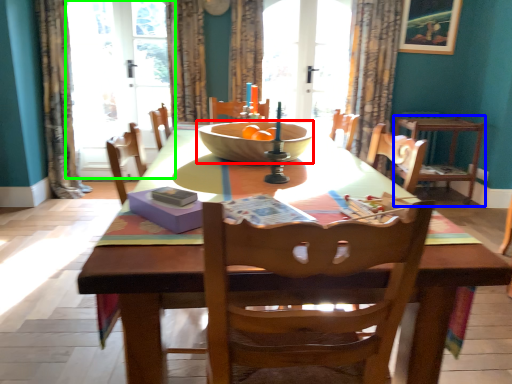
Question: Considering the real-world distances, which object is farthest from bowl (highlighted by a red box)? chair (highlighted by a blue box) or screen door (highlighted by a green box)?

Choices:
 (A) chair
 (B) screen door

Answer: (B)